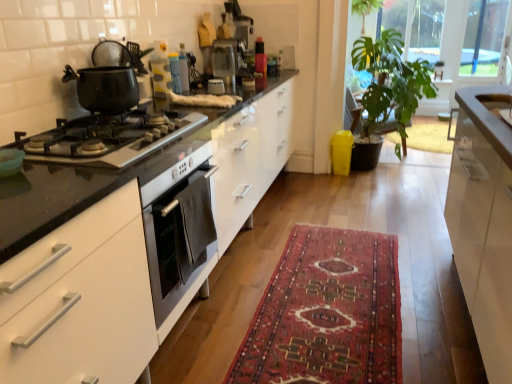
The image size is (512, 384). Describe the element at coordinates (416, 26) in the screenshot. I see `green leafy plant at upper right, the first window screen in the left-to-right sequence` at that location.

The width and height of the screenshot is (512, 384). What do you see at coordinates (216, 87) in the screenshot? I see `metallic silver toaster at center, the 2th appliance from the left` at bounding box center [216, 87].

The image size is (512, 384). Identify the location of granite black pot at left. (105, 88).

The height and width of the screenshot is (384, 512). I want to click on green leafy plant at center, so click(390, 83).

Identify the location of red woven rug at center. The height and width of the screenshot is (384, 512). (327, 313).

Is green leafy plant at upper right, the first window screen in the left-to-right sequence, thinner than metallic silver toaster at center, the first appliance in the right-to-left sequence?

No.

Does green leafy plant at upper right, the first window screen in the left-to-right sequence, have a larger size compared to metallic silver toaster at center, acting as the 1th appliance starting from the front?

Yes, green leafy plant at upper right, the first window screen in the left-to-right sequence, is bigger than metallic silver toaster at center, acting as the 1th appliance starting from the front.

Between point (421, 2) and point (207, 89), which one is positioned in front?

The point (207, 89) is closer to the camera.

Considering the sizes of metallic silver toaster at center, which is the second appliance from back to front, and white glossy sink at upper right in the image, is metallic silver toaster at center, which is the second appliance from back to front, taller or shorter than white glossy sink at upper right?

Clearly, metallic silver toaster at center, which is the second appliance from back to front, is shorter compared to white glossy sink at upper right.

Measure the distance from metallic silver toaster at center, which is the second appliance from back to front, to white glossy sink at upper right.

metallic silver toaster at center, which is the second appliance from back to front, and white glossy sink at upper right are 1.56 meters apart.

From the image's perspective, which one is positioned lower, metallic silver toaster at center, the first appliance in the right-to-left sequence, or white glossy sink at upper right?

white glossy sink at upper right is shown below in the image.

Which of these two, metallic silver toaster at center, acting as the 1th appliance starting from the front, or white glossy sink at upper right, is smaller?

metallic silver toaster at center, acting as the 1th appliance starting from the front, is smaller.

Can you confirm if matte plastic container at upper center, the first appliance positioned from the back, is positioned to the right of transparent glass window screen at upper right, the second window screen in the left-to-right sequence?

No, matte plastic container at upper center, the first appliance positioned from the back, is not to the right of transparent glass window screen at upper right, the second window screen in the left-to-right sequence.

Is point (186, 79) closer to camera compared to point (505, 12)?

That is True.

Is matte plastic container at upper center, which is the second appliance in right-to-left order, next to transparent glass window screen at upper right, positioned as the 1th window screen in right-to-left order?

matte plastic container at upper center, which is the second appliance in right-to-left order, and transparent glass window screen at upper right, positioned as the 1th window screen in right-to-left order, are not in contact.

Is matte plastic container at upper center, which is the 2th appliance from front to back, closer to camera compared to transparent glass window screen at upper right, the second window screen in the left-to-right sequence?

Yes, it is.

Can you confirm if granite black pot at left is shorter than black glass gas stove at left, the first gas stove when ordered from bottom to top?

Yes, granite black pot at left is shorter than black glass gas stove at left, the first gas stove when ordered from bottom to top.

Between granite black pot at left and black glass gas stove at left, the 2th gas stove when ordered from top to bottom, which one appears on the right side from the viewer's perspective?

black glass gas stove at left, the 2th gas stove when ordered from top to bottom, is more to the right.

How far apart are granite black pot at left and black glass gas stove at left, the 2th gas stove when ordered from top to bottom?

The distance of granite black pot at left from black glass gas stove at left, the 2th gas stove when ordered from top to bottom, is 11.91 inches.

Which object is thinner, granite black pot at left or black glass gas stove at left, the first gas stove when ordered from bottom to top?

granite black pot at left.

The height and width of the screenshot is (384, 512). What are the coordinates of `cabinetry located below the green leafy plant at center (from the image's perspective)` in the screenshot? It's located at (484, 221).

Is green leafy plant at center oriented away from white glossy cabinet at right?

green leafy plant at center is not turned away from white glossy cabinet at right.

From the image's perspective, which object appears higher, green leafy plant at center or white glossy cabinet at right?

green leafy plant at center, from the image's perspective.

Considering the relative sizes of black glass gas stove at left, the 2th gas stove when ordered from top to bottom, and transparent glass window screen at upper right, positioned as the 1th window screen in right-to-left order, in the image provided, is black glass gas stove at left, the 2th gas stove when ordered from top to bottom, bigger than transparent glass window screen at upper right, positioned as the 1th window screen in right-to-left order,?

Indeed, black glass gas stove at left, the 2th gas stove when ordered from top to bottom, has a larger size compared to transparent glass window screen at upper right, positioned as the 1th window screen in right-to-left order.

Between black glass gas stove at left, the first gas stove when ordered from bottom to top, and transparent glass window screen at upper right, positioned as the 1th window screen in right-to-left order, which one has larger width?

With larger width is black glass gas stove at left, the first gas stove when ordered from bottom to top.

Which of these two, black glass gas stove at left, the first gas stove when ordered from bottom to top, or transparent glass window screen at upper right, positioned as the 1th window screen in right-to-left order, stands shorter?

black glass gas stove at left, the first gas stove when ordered from bottom to top, is shorter.

Which is in front, black glass gas stove at left, the first gas stove when ordered from bottom to top, or transparent glass window screen at upper right, positioned as the 1th window screen in right-to-left order?

black glass gas stove at left, the first gas stove when ordered from bottom to top, is closer to the camera.

From a real-world perspective, who is located lower, white glossy sink at upper right or transparent plastic coffee machine at center?

From a 3D spatial view, white glossy sink at upper right is below.

Is white glossy sink at upper right bigger or smaller than transparent plastic coffee machine at center?

Considering their sizes, white glossy sink at upper right takes up less space than transparent plastic coffee machine at center.

Is the position of white glossy sink at upper right less distant than that of transparent plastic coffee machine at center?

Yes, white glossy sink at upper right is in front of transparent plastic coffee machine at center.

Which point is more forward, (x=497, y=97) or (x=223, y=43)?

The point (x=497, y=97) is in front.

From the image's perspective, which appliance is the 2nd one below the green leafy plant at upper right, the second window screen when ordered from right to left? Please provide its 2D coordinates.

[(216, 87)]

At what (x,y) coordinates should I click in order to perform the action: click on appliance that is the 1st one when counting backward from the white glossy sink at upper right. Please return your answer as a coordinate pair (x, y). This screenshot has height=384, width=512. Looking at the image, I should click on (216, 87).

Considering their positions, is transparent plastic coffee machine at center positioned closer to red woven rug at center than granite black pot at left?

Among the two, granite black pot at left is located nearer to red woven rug at center.

Estimate the real-world distances between objects in this image. Which object is further from green leafy plant at upper right, the first window screen in the left-to-right sequence, granite black pot at left or red woven rug at center?

The object further to green leafy plant at upper right, the first window screen in the left-to-right sequence, is granite black pot at left.

When comparing their distances from matte plastic container at upper center, which is the second appliance in right-to-left order, does metallic silver toaster at center, the first appliance in the right-to-left sequence, or red woven rug at center seem further?

red woven rug at center lies further to matte plastic container at upper center, which is the second appliance in right-to-left order, than the other object.

Based on their spatial positions, is white glossy sink at upper right or matte plastic container at upper center, which is the second appliance in right-to-left order, closer to transparent glass window screen at upper right, positioned as the 1th window screen in right-to-left order?

Among the two, white glossy sink at upper right is located nearer to transparent glass window screen at upper right, positioned as the 1th window screen in right-to-left order.

Which object lies nearer to the anchor point transparent glass window screen at upper right, the second window screen in the left-to-right sequence, red woven rug at center or matte plastic container at upper center, the first appliance positioned from the back?

Among the two, matte plastic container at upper center, the first appliance positioned from the back, is located nearer to transparent glass window screen at upper right, the second window screen in the left-to-right sequence.

Considering their positions, is black glass gas stove at left, the 2th gas stove when ordered from top to bottom, positioned closer to shiny black gas stove at left, the 1th gas stove positioned from the top, than granite black pot at left?

The object closer to shiny black gas stove at left, the 1th gas stove positioned from the top, is black glass gas stove at left, the 2th gas stove when ordered from top to bottom.

Considering their positions, is green leafy plant at upper right, the second window screen when ordered from right to left, positioned closer to transparent plastic coffee machine at center than white glossy cabinet at right?

Among the two, white glossy cabinet at right is located nearer to transparent plastic coffee machine at center.

Which object lies nearer to the anchor point shiny black gas stove at left, the 1th gas stove positioned from the top, white glossy cabinet at right or metallic silver toaster at center, the 2th appliance from the left?

white glossy cabinet at right lies closer to shiny black gas stove at left, the 1th gas stove positioned from the top, than the other object.

At what (x,y) coordinates should I click in order to perform the action: click on kitchen appliance between black glass gas stove at left, the first gas stove when ordered from bottom to top, and matte plastic container at upper center, the first appliance positioned from the back, in the front-back direction. Please return your answer as a coordinate pair (x, y). This screenshot has height=384, width=512. Looking at the image, I should click on (105, 88).

Identify the location of coffee machine between shiny black gas stove at left, the second gas stove when ordered from bottom to top, and transparent glass window screen at upper right, the second window screen in the left-to-right sequence, along the z-axis. (227, 62).

What are the coordinates of `coffee machine situated between metallic silver toaster at center, which is the second appliance from back to front, and green leafy plant at center from left to right` in the screenshot? It's located at (227, 62).

The width and height of the screenshot is (512, 384). Identify the location of houseplant between black glass gas stove at left, the 2th gas stove when ordered from top to bottom, and transparent glass window screen at upper right, positioned as the 1th window screen in right-to-left order, in the front-back direction. (390, 83).